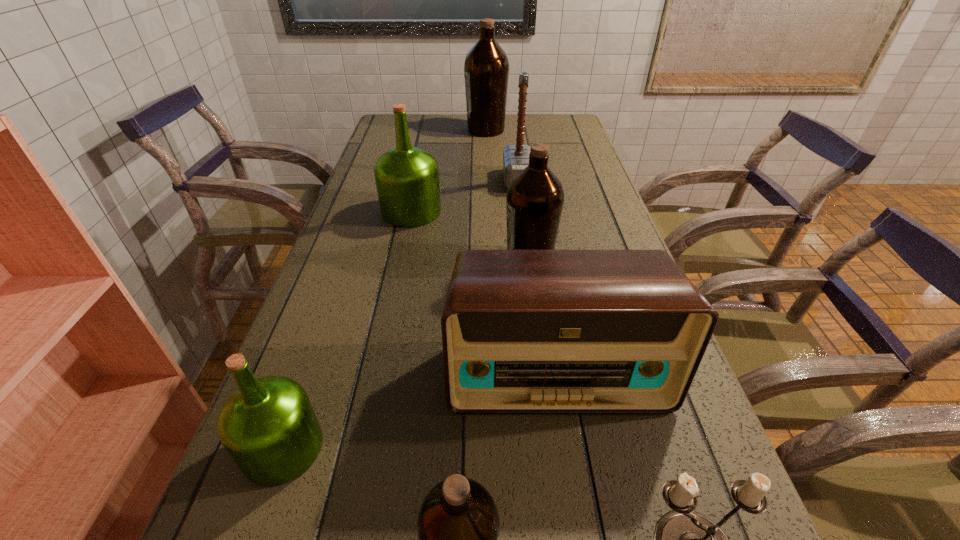
I want to click on free spot located 0.290m on the label of the third farthest olive oil, so click(x=386, y=261).

What are the coordinates of `vacant space located on the front-facing side of the radio receiver` in the screenshot? It's located at (581, 528).

The image size is (960, 540). What are the coordinates of `vacant area situated 0.320m on the right of the smaller green olive oil` in the screenshot? It's located at (517, 448).

You are a GUI agent. You are given a task and a screenshot of the screen. Output one action in this format:
    pyautogui.click(x=<x>, y=<y>)
    Task: Click on the object that is at the far edge
    The height and width of the screenshot is (540, 960).
    Given the screenshot: What is the action you would take?
    pyautogui.click(x=486, y=68)

Locate an element on the screen. The image size is (960, 540). object present at the right edge is located at coordinates (523, 331).

Where is `vacant space at the far edge`? vacant space at the far edge is located at coordinates (509, 124).

Where is `vacant space at the left edge`? The width and height of the screenshot is (960, 540). vacant space at the left edge is located at coordinates (336, 289).

The width and height of the screenshot is (960, 540). Identify the location of blank space at the right edge. (591, 171).

In the image, there is a desktop. Where is `vacant space at the far left corner`? vacant space at the far left corner is located at coordinates (387, 124).

Identify the location of free spot between the brown hammer and the smaller green olive oil. (400, 314).